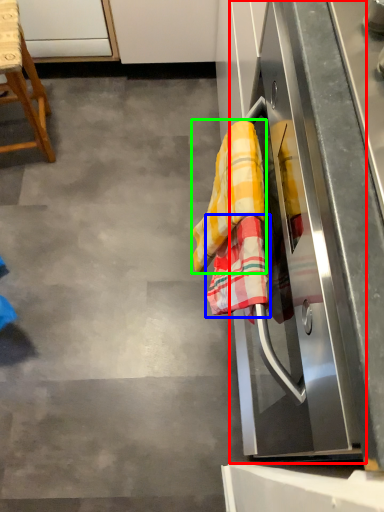
Question: Which object is positioned farthest from oven (highlighted by a red box)? Select from beach towel (highlighted by a blue box) and material (highlighted by a green box).

Choices:
 (A) beach towel
 (B) material

Answer: (B)